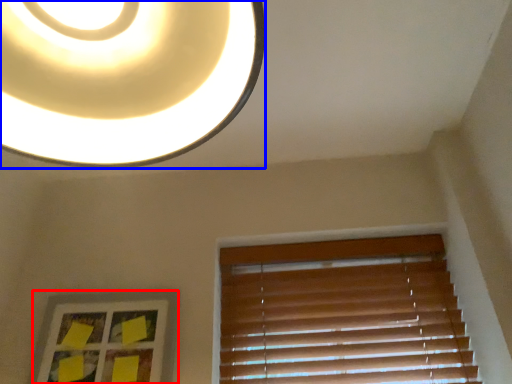
Question: Among these objects, which one is nearest to the camera, picture frame (highlighted by a red box) or lamp (highlighted by a blue box)?

Choices:
 (A) picture frame
 (B) lamp

Answer: (B)